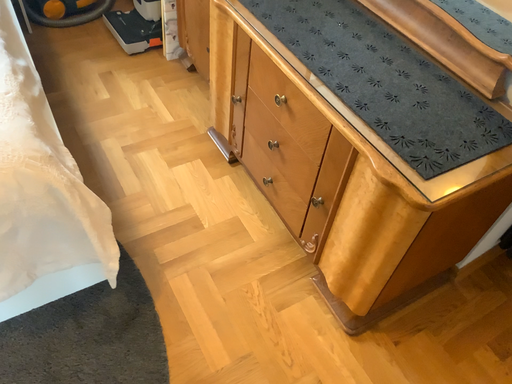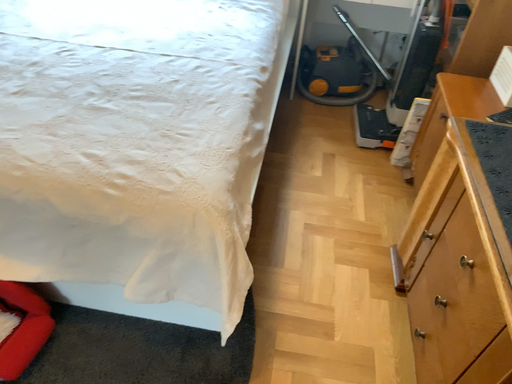
Question: How did the camera likely rotate when shooting the video?

Choices:
 (A) rotated upward
 (B) rotated downward

Answer: (A)